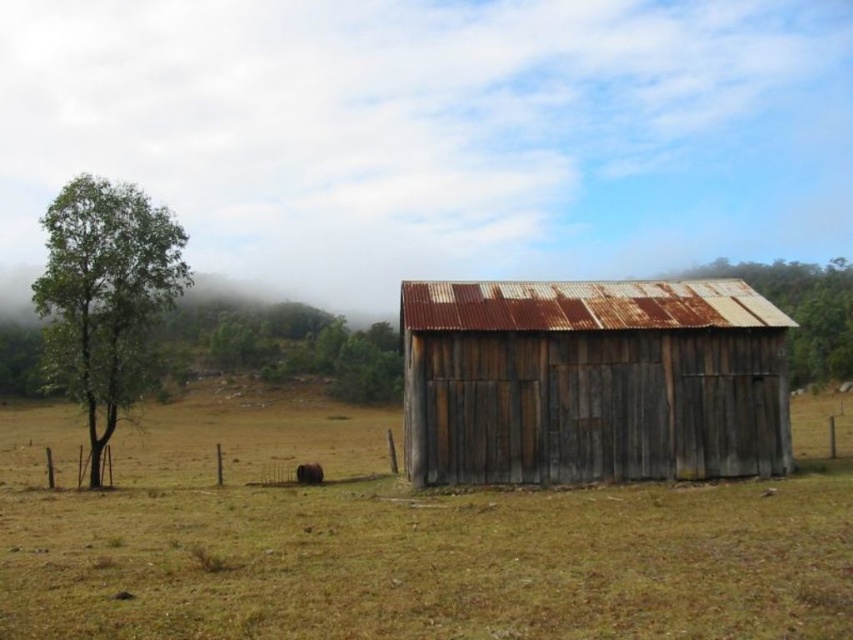
Does rusty wood shed at center appear over green leafy tree at left?

No, rusty wood shed at center is not above green leafy tree at left.

This screenshot has height=640, width=853. What do you see at coordinates (592, 381) in the screenshot? I see `rusty wood shed at center` at bounding box center [592, 381].

Which is in front, point (653, 451) or point (113, 356)?

Point (653, 451) is in front.

The height and width of the screenshot is (640, 853). I want to click on rusty wood shed at center, so click(592, 381).

Describe the element at coordinates (405, 541) in the screenshot. I see `dry grass at center` at that location.

Identify the location of dry grass at center. pos(405,541).

Does green leafy tree at left appear over brown fur dog at lower center?

Yes, green leafy tree at left is above brown fur dog at lower center.

Does green leafy tree at left have a lesser width compared to brown fur dog at lower center?

No, green leafy tree at left is not thinner than brown fur dog at lower center.

Describe the element at coordinates (105, 296) in the screenshot. I see `green leafy tree at left` at that location.

Identify the location of green leafy tree at left. (105, 296).